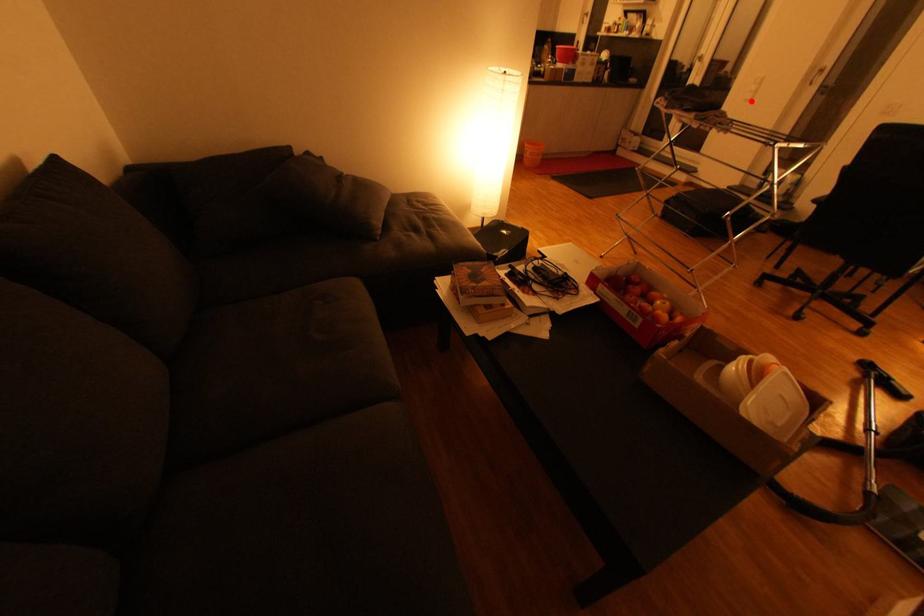
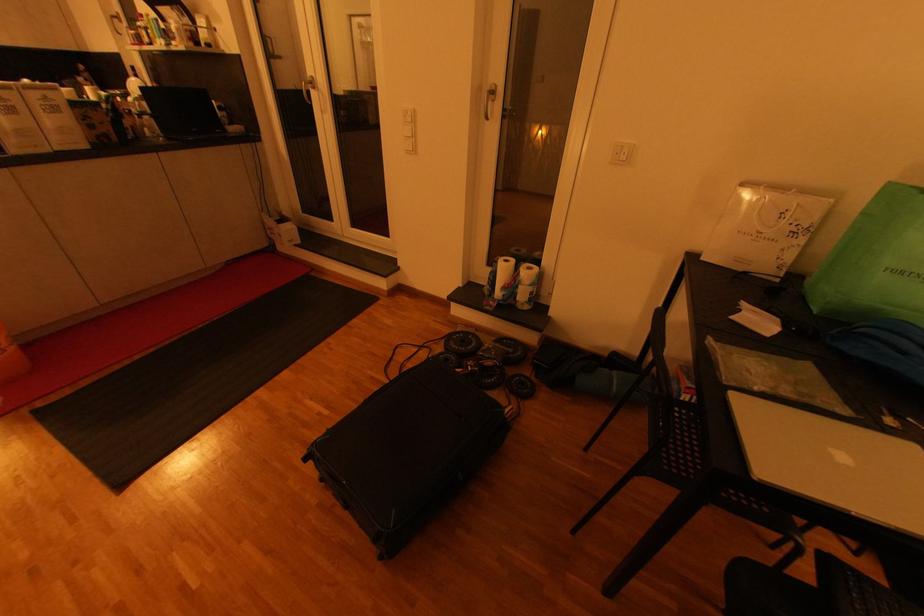
Question: I am providing you with two images of the same scene from different viewpoints. In image1, a red point is highlighted. Considering the same 3D point in image2, which of the following is correct?

Choices:
 (A) It is closer
 (B) It is farther

Answer: (A)